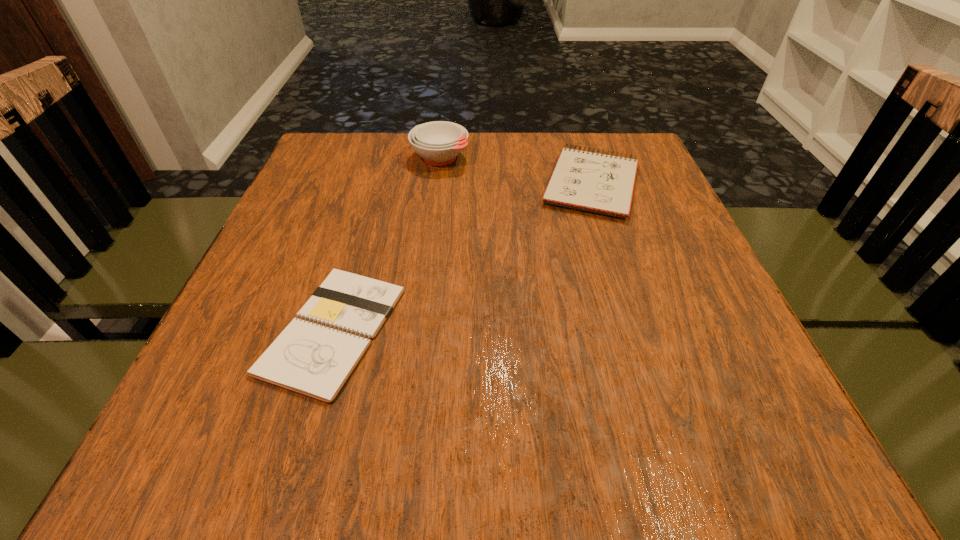
Where is `soup bowl`? soup bowl is located at coordinates (439, 142).

This screenshot has width=960, height=540. Find the location of `the farther notepad`. the farther notepad is located at coordinates (600, 183).

Locate an element on the screen. the taller notepad is located at coordinates (600, 183).

The width and height of the screenshot is (960, 540). In order to click on the shortest object in this screenshot , I will do `click(315, 355)`.

Where is `the nearest object`? Image resolution: width=960 pixels, height=540 pixels. the nearest object is located at coordinates (315, 355).

Where is `vacant space situated on the left of the soup bowl`? This screenshot has height=540, width=960. vacant space situated on the left of the soup bowl is located at coordinates (308, 158).

Where is `free region located 0.340m on the left of the taller notepad`? free region located 0.340m on the left of the taller notepad is located at coordinates (393, 184).

The height and width of the screenshot is (540, 960). I want to click on vacant space located on the left of the left notepad, so click(239, 330).

Image resolution: width=960 pixels, height=540 pixels. Identify the location of soup bowl at the far edge. pos(439,142).

Locate an element on the screen. The width and height of the screenshot is (960, 540). notepad positioned at the far edge is located at coordinates (600, 183).